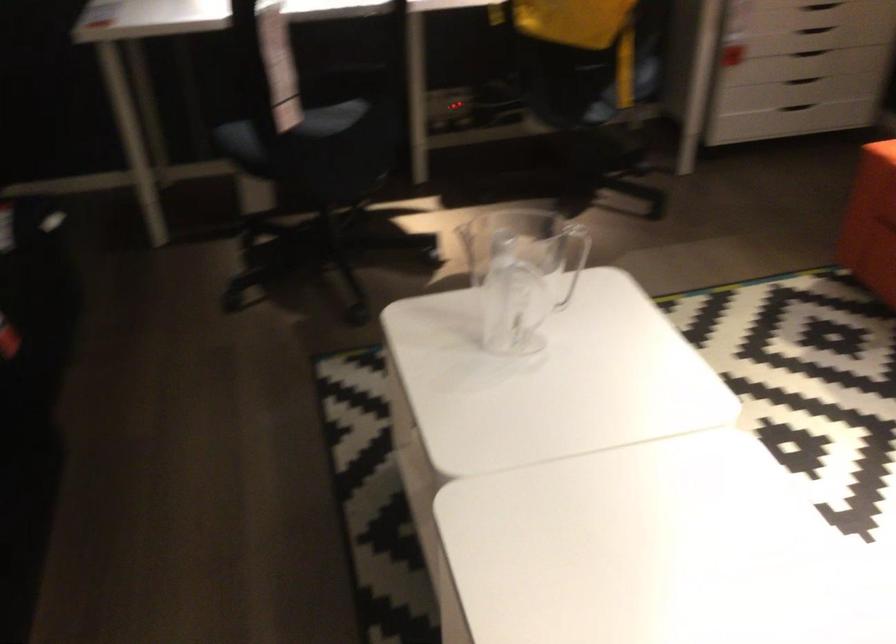
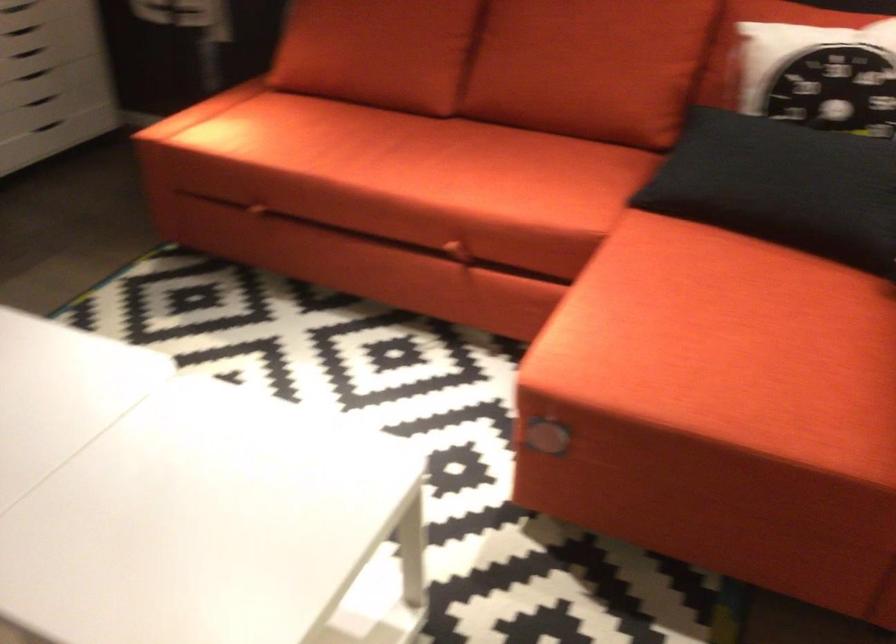
Question: The first image is from the beginning of the video and the second image is from the end. How did the camera likely rotate when shooting the video?

Choices:
 (A) Left
 (B) Right
 (C) Up
 (D) Down

Answer: (B)